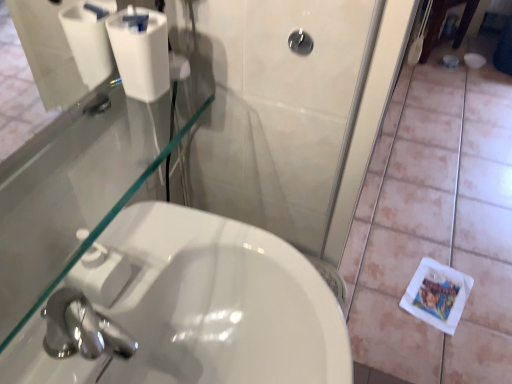
The width and height of the screenshot is (512, 384). What do you see at coordinates (200, 308) in the screenshot?
I see `white glossy sink at lower left` at bounding box center [200, 308].

Describe the element at coordinates (437, 225) in the screenshot. The image size is (512, 384). I see `white matte tile at lower right` at that location.

Where is `white glossy sink at lower left`? Image resolution: width=512 pixels, height=384 pixels. white glossy sink at lower left is located at coordinates (200, 308).

Could you tell me if white glossy sink at lower left is facing white matte tile at lower right?

No, white glossy sink at lower left is not turned towards white matte tile at lower right.

Does white glossy sink at lower left have a lesser width compared to white matte tile at lower right?

Indeed, white glossy sink at lower left has a lesser width compared to white matte tile at lower right.

From the image's perspective, which is above, white glossy sink at lower left or white matte tile at lower right?

From the image's view, white matte tile at lower right is above.

Based on the photo, can you tell me how much white glossy sink at lower left and white matte tile at lower right differ in facing direction?

They differ by 90.1 degrees in their facing directions.

Who is smaller, white glossy sink at lower left or white matte toilet paper at upper left?

white matte toilet paper at upper left is smaller.

From the image's perspective, which one is positioned lower, white glossy sink at lower left or white matte toilet paper at upper left?

A: white glossy sink at lower left, from the image's perspective.

Could you tell me if white glossy sink at lower left is turned towards white matte toilet paper at upper left?

No, white glossy sink at lower left is not aimed at white matte toilet paper at upper left.

Is the surface of white glossy sink at lower left in direct contact with white matte toilet paper at upper left?

They are not placed beside each other.

Find the location of a particular element. The height and width of the screenshot is (384, 512). sink that appears above the white matte tile at lower right (from a real-world perspective) is located at coordinates (200, 308).

Which of these two, white matte tile at lower right or white glossy sink at lower left, stands shorter?

Standing shorter between the two is white matte tile at lower right.

Does point (379, 312) come farther from viewer compared to point (153, 364)?

That is True.

Between white matte tile at lower right and white glossy sink at lower left, which one has smaller size?

white glossy sink at lower left.

Consider the image. Between white matte tile at lower right and white matte toilet paper at upper left, which one has larger size?

white matte tile at lower right is bigger.

Find the location of `tile directly beneath the white matte toilet paper at upper left (from a real-world perspective)`. tile directly beneath the white matte toilet paper at upper left (from a real-world perspective) is located at coordinates (437, 225).

From their relative heights in the image, would you say white matte tile at lower right is taller or shorter than white matte toilet paper at upper left?

Considering their sizes, white matte tile at lower right has less height than white matte toilet paper at upper left.

Is white matte toilet paper at upper left turned away from white matte tile at lower right?

No, white matte toilet paper at upper left's orientation is not away from white matte tile at lower right.

Is white matte toilet paper at upper left to the left or to the right of white matte tile at lower right in the image?

In the image, white matte toilet paper at upper left appears on the left side of white matte tile at lower right.

Which object is further away from the camera taking this photo, white matte toilet paper at upper left or white matte tile at lower right?

white matte tile at lower right is behind.

From the picture: Considering the sizes of objects white matte toilet paper at upper left and black glossy showerhead at upper center in the image provided, who is smaller, white matte toilet paper at upper left or black glossy showerhead at upper center?

Smaller between the two is black glossy showerhead at upper center.

Based on the photo, is white matte toilet paper at upper left with black glossy showerhead at upper center?

No, white matte toilet paper at upper left is not beside black glossy showerhead at upper center.

In terms of width, does white matte toilet paper at upper left look wider or thinner when compared to black glossy showerhead at upper center?

white matte toilet paper at upper left is wider than black glossy showerhead at upper center.

Relative to black glossy showerhead at upper center, is white matte toilet paper at upper left in front or behind?

Clearly, white matte toilet paper at upper left is in front of black glossy showerhead at upper center.

Is black glossy showerhead at upper center positioned in front of white matte tile at lower right?

Yes, it is.

From the picture: Which of these two, black glossy showerhead at upper center or white matte tile at lower right, is bigger?

white matte tile at lower right.

Is black glossy showerhead at upper center oriented towards white matte tile at lower right?

No, black glossy showerhead at upper center is not turned towards white matte tile at lower right.

Does point (303, 33) come farther from viewer compared to point (362, 317)?

That is False.

I want to click on tile that is behind the white glossy sink at lower left, so click(437, 225).

Locate an element on the screen. Image resolution: width=512 pixels, height=384 pixels. toilet paper on the left side of white glossy sink at lower left is located at coordinates (141, 51).

Considering their positions, is white glossy sink at lower left positioned closer to white matte tile at lower right than white matte toilet paper at upper left?

white glossy sink at lower left is positioned closer to the anchor white matte tile at lower right.

When comparing their distances from white matte tile at lower right, does white glossy sink at lower left or black glossy showerhead at upper center seem closer?

white glossy sink at lower left is positioned closer to the anchor white matte tile at lower right.

Based on their spatial positions, is white matte toilet paper at upper left or black glossy showerhead at upper center further from white matte tile at lower right?

black glossy showerhead at upper center.

Looking at the image, which one is located further to black glossy showerhead at upper center, white glossy sink at lower left or white matte toilet paper at upper left?

Based on the image, white glossy sink at lower left appears to be further to black glossy showerhead at upper center.

Estimate the real-world distances between objects in this image. Which object is closer to white glossy sink at lower left, white matte toilet paper at upper left or white matte tile at lower right?

Based on the image, white matte toilet paper at upper left appears to be nearer to white glossy sink at lower left.

Looking at the image, which one is located further to black glossy showerhead at upper center, white matte tile at lower right or white matte toilet paper at upper left?

white matte tile at lower right lies further to black glossy showerhead at upper center than the other object.

Looking at the image, which one is located closer to white matte toilet paper at upper left, white matte tile at lower right or black glossy showerhead at upper center?

black glossy showerhead at upper center.

Looking at the image, which one is located further to white matte toilet paper at upper left, black glossy showerhead at upper center or white matte tile at lower right?

white matte tile at lower right.

At what (x,y) coordinates should I click in order to perform the action: click on shower between white matte toilet paper at upper left and white matte tile at lower right in the horizontal direction. Please return your answer as a coordinate pair (x, y). Looking at the image, I should click on (300, 42).

Where is `sink situated between white matte toilet paper at upper left and white matte tile at lower right from left to right`? sink situated between white matte toilet paper at upper left and white matte tile at lower right from left to right is located at coordinates (200, 308).

This screenshot has height=384, width=512. I want to click on toilet paper that lies between black glossy showerhead at upper center and white glossy sink at lower left from top to bottom, so (x=141, y=51).

The height and width of the screenshot is (384, 512). Find the location of `shower situated between white glossy sink at lower left and white matte tile at lower right from left to right`. shower situated between white glossy sink at lower left and white matte tile at lower right from left to right is located at coordinates (300, 42).